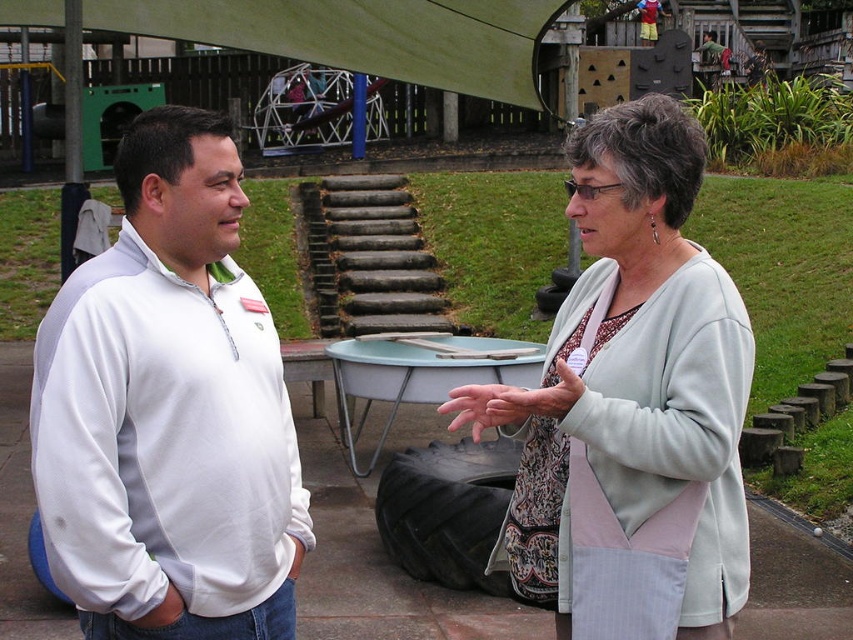
Is white fabric shirt at left bigger than green wood canopy at upper center?

Actually, white fabric shirt at left might be smaller than green wood canopy at upper center.

Who is more distant from viewer, (x=146, y=388) or (x=271, y=17)?

The point (x=271, y=17) is behind.

Is point (129, 596) closer to viewer compared to point (212, 24)?

Yes, it is.

You are a GUI agent. You are given a task and a screenshot of the screen. Output one action in this format:
    pyautogui.click(x=<x>, y=<y>)
    Task: Click on the white fabric shirt at left
    The image size is (853, 640).
    Given the screenshot: What is the action you would take?
    pyautogui.click(x=169, y=410)

Consider the image. Is light gray cardigan at center taller than green wood canopy at upper center?

Yes.

Which is behind, point (521, 486) or point (166, 32)?

Point (166, 32)

Measure the distance between point (634, 292) and camera.

The distance of point (634, 292) from camera is 4.18 meters.

Identify the location of light gray cardigan at center. (631, 404).

In the scene shown: Can you confirm if white fabric shirt at left is positioned to the right of light gray cardigan at center?

Incorrect, white fabric shirt at left is not on the right side of light gray cardigan at center.

Does white fabric shirt at left appear on the left side of light gray cardigan at center?

Yes, white fabric shirt at left is to the left of light gray cardigan at center.

Does point (177, 376) come closer to viewer compared to point (605, 484)?

Yes, it is.

Where is `white fabric shirt at left`? white fabric shirt at left is located at coordinates (169, 410).